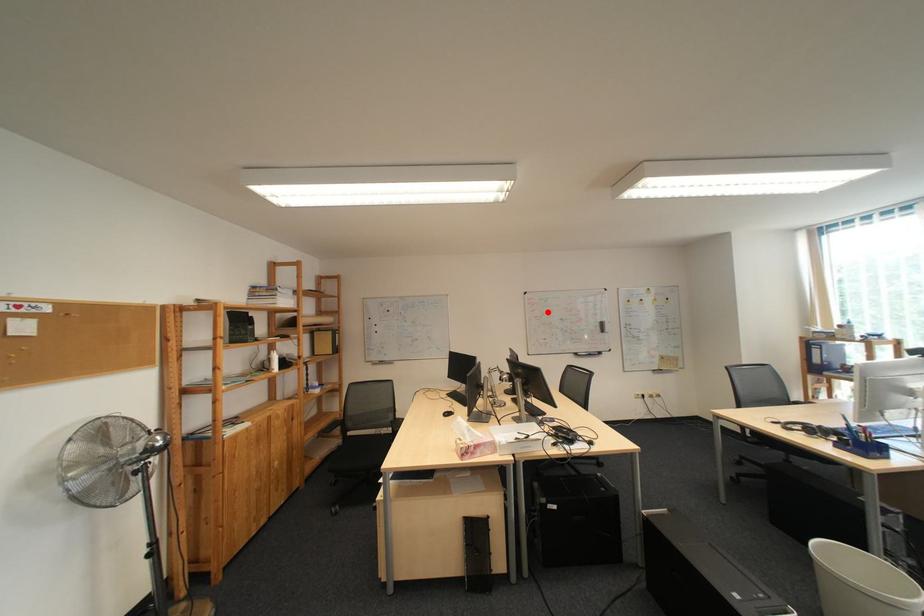
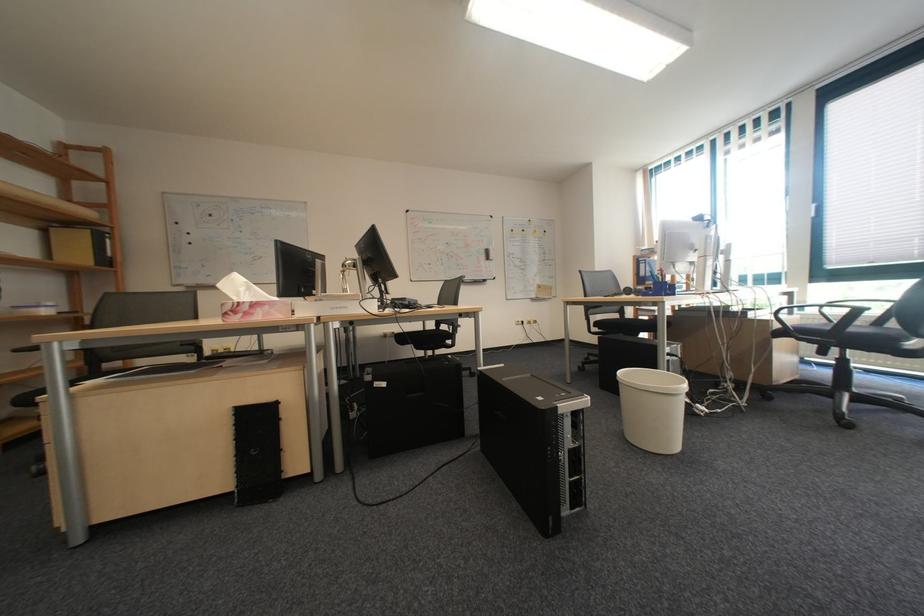
Question: A red point is marked in image1. In image2, is the corresponding 3D point closer to the camera or farther? Reply with the corresponding letter.

Choices:
 (A) The corresponding 3D point is closer.
 (B) The corresponding 3D point is farther.

Answer: (A)